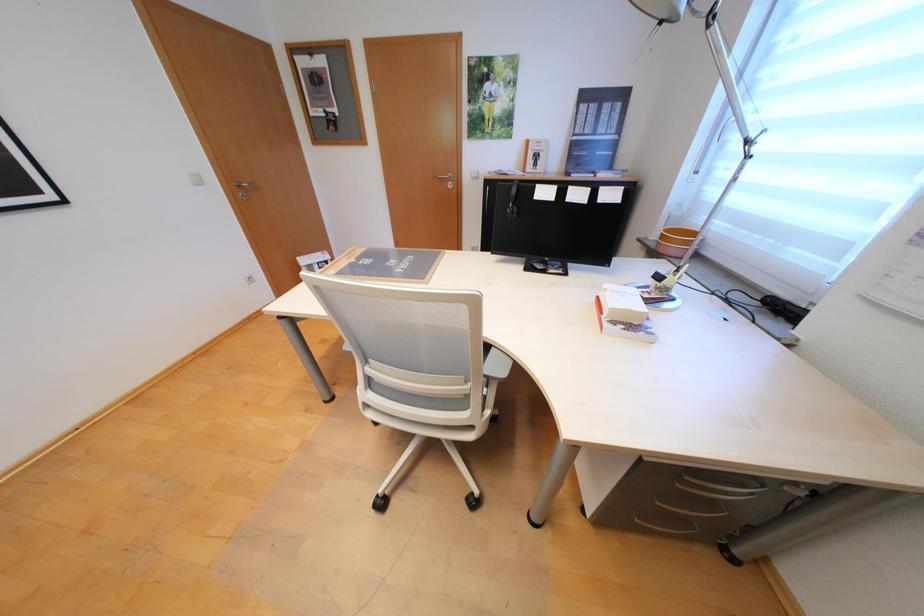
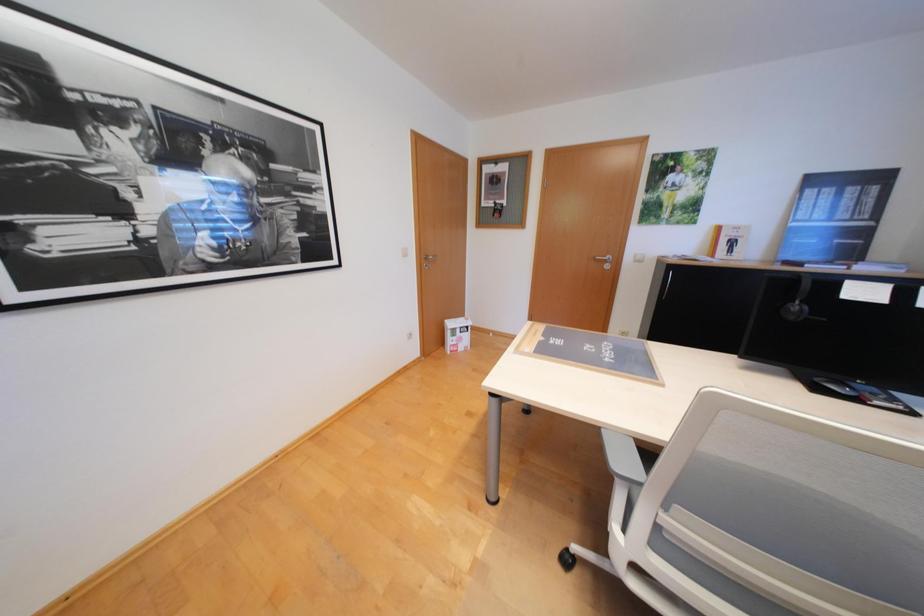
Question: The camera is either moving clockwise (left) or counter-clockwise (right) around the object. The first image is from the beginning of the video and the second image is from the end. Is the camera moving left or right when shooting the video?

Choices:
 (A) Left
 (B) Right

Answer: (B)